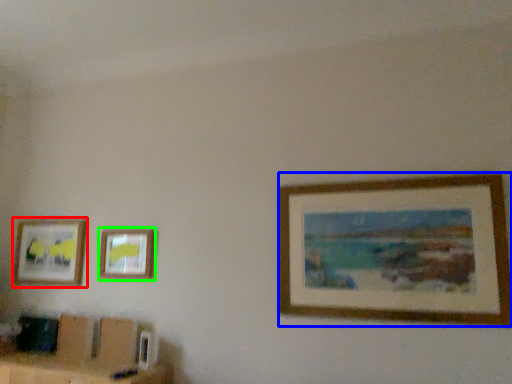
Question: Considering the real-world distances, which object is farthest from picture frame (highlighted by a red box)? picture frame (highlighted by a blue box) or picture frame (highlighted by a green box)?

Choices:
 (A) picture frame
 (B) picture frame

Answer: (A)